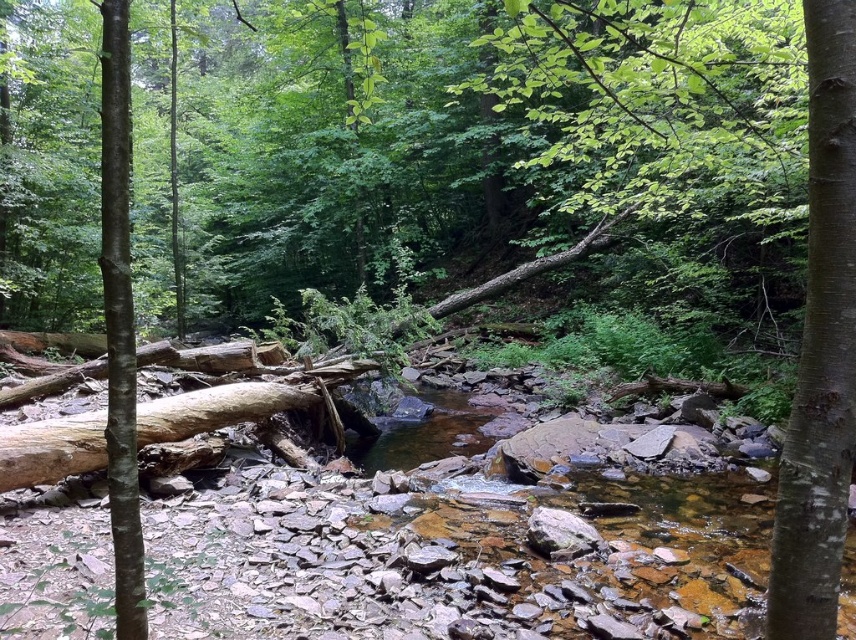
You are a hiker carrying a heavy backpack and need to cross the stream. You see the white smooth tree trunk at center and the smooth brown tree trunk at left. Which tree trunk is narrower and safer to step on?

The white smooth tree trunk at center is narrower than the smooth brown tree trunk at left, so it might be less stable. The smooth brown tree trunk at left is wider and safer to step on.

From the picture: You are a hiker trying to cross the stream in the forest. You notice the white smooth tree trunk at center and the smooth brown tree trunk at left. Which one would be easier to step on without slipping, considering their surface textures?

The white smooth tree trunk at center has a smoother surface compared to the smooth brown tree trunk at left, making it potentially more slippery. However, the smooth brown tree trunk at left occupies more space, providing a larger surface area for stable footing. Therefore, the smooth brown tree trunk at left might be easier to step on without slipping due to its wider base and possibly less slippery texture.